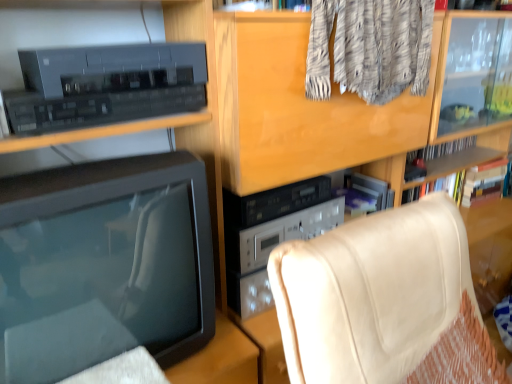
Question: Are beige leather chair at lower right and matte black television at left located far from each other?

Choices:
 (A) no
 (B) yes

Answer: (A)

Question: From a real-world perspective, is beige leather chair at lower right physically below matte black television at left?

Choices:
 (A) yes
 (B) no

Answer: (A)

Question: Can you confirm if beige leather chair at lower right is wider than matte black television at left?

Choices:
 (A) no
 (B) yes

Answer: (B)

Question: Does beige leather chair at lower right lie behind matte black television at left?

Choices:
 (A) no
 (B) yes

Answer: (A)

Question: Can you confirm if beige leather chair at lower right is smaller than matte black television at left?

Choices:
 (A) no
 (B) yes

Answer: (A)

Question: From the image's perspective, is beige leather chair at lower right on matte black television at left?

Choices:
 (A) no
 (B) yes

Answer: (A)

Question: Considering the relative sizes of matte black television at left and beige leather chair at lower right in the image provided, is matte black television at left smaller than beige leather chair at lower right?

Choices:
 (A) no
 (B) yes

Answer: (B)

Question: From a real-world perspective, does matte black television at left sit lower than beige leather chair at lower right?

Choices:
 (A) yes
 (B) no

Answer: (B)

Question: Considering the relative positions of matte black television at left and beige leather chair at lower right in the image provided, is matte black television at left to the right of beige leather chair at lower right from the viewer's perspective?

Choices:
 (A) yes
 (B) no

Answer: (B)

Question: Is matte black television at left positioned before beige leather chair at lower right?

Choices:
 (A) yes
 (B) no

Answer: (B)

Question: Does matte black television at left turn towards beige leather chair at lower right?

Choices:
 (A) no
 (B) yes

Answer: (A)

Question: Is matte black television at left further to the viewer compared to beige leather chair at lower right?

Choices:
 (A) yes
 (B) no

Answer: (A)

Question: Considering the positions of point (148, 251) and point (382, 248), is point (148, 251) closer or farther from the camera than point (382, 248)?

Choices:
 (A) closer
 (B) farther

Answer: (B)